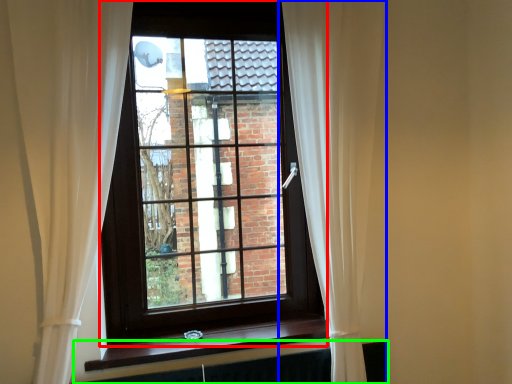
Question: Which object is the closest to the window (highlighted by a red box)? Choose among these: curtain (highlighted by a blue box) or radiator (highlighted by a green box).

Choices:
 (A) curtain
 (B) radiator

Answer: (A)